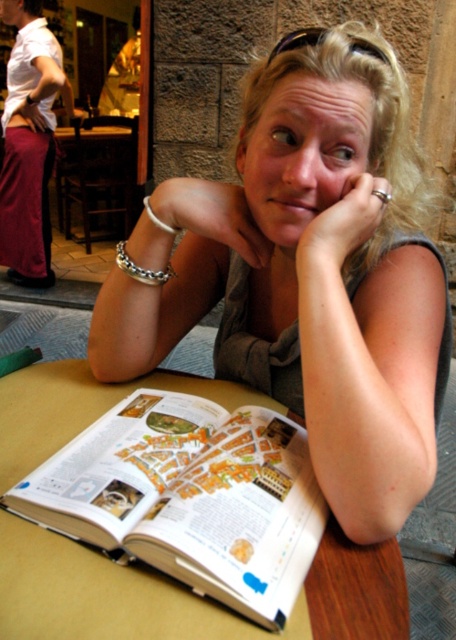
Question: Can you confirm if matte gray shirt at center is smaller than silver metallic bracelet at upper left?

Choices:
 (A) yes
 (B) no

Answer: (B)

Question: Which point is farther from the camera taking this photo?

Choices:
 (A) tap(377, 131)
 (B) tap(130, 260)

Answer: (B)

Question: Which point is closer to the camera?

Choices:
 (A) silver metallic bracelet at upper left
 (B) silver metallic bracelet at left
 (C) matte gray shirt at center
 (D) white paper book at center

Answer: (D)

Question: Is matte gray shirt at center wider than silver metallic bracelet at upper left?

Choices:
 (A) no
 (B) yes

Answer: (B)

Question: Is matte gray shirt at center to the right of silver metallic bracelet at left from the viewer's perspective?

Choices:
 (A) yes
 (B) no

Answer: (A)

Question: Based on their relative distances, which object is nearer to the silver metallic bracelet at left?

Choices:
 (A) silver metallic bracelet at upper left
 (B) matte gray shirt at center

Answer: (A)